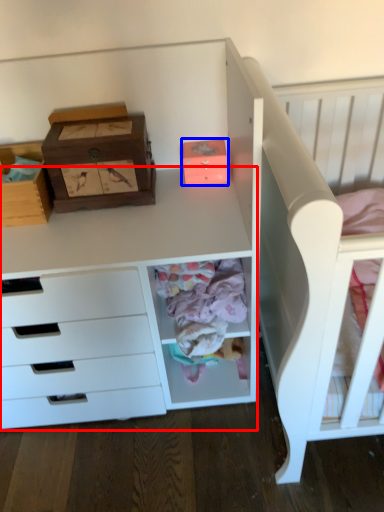
Question: Which object is closer to the camera taking this photo, computer desk (highlighted by a red box) or shoe box (highlighted by a blue box)?

Choices:
 (A) computer desk
 (B) shoe box

Answer: (A)